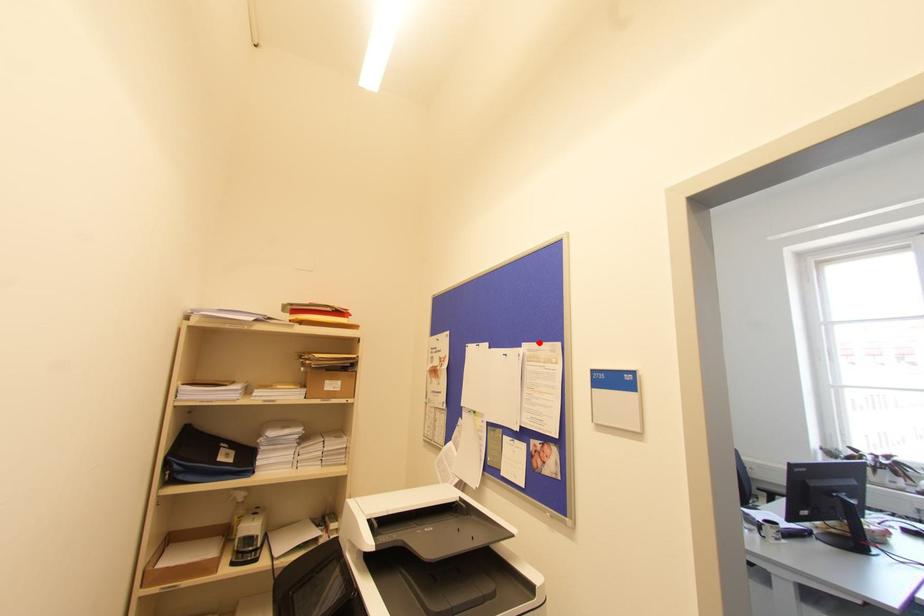
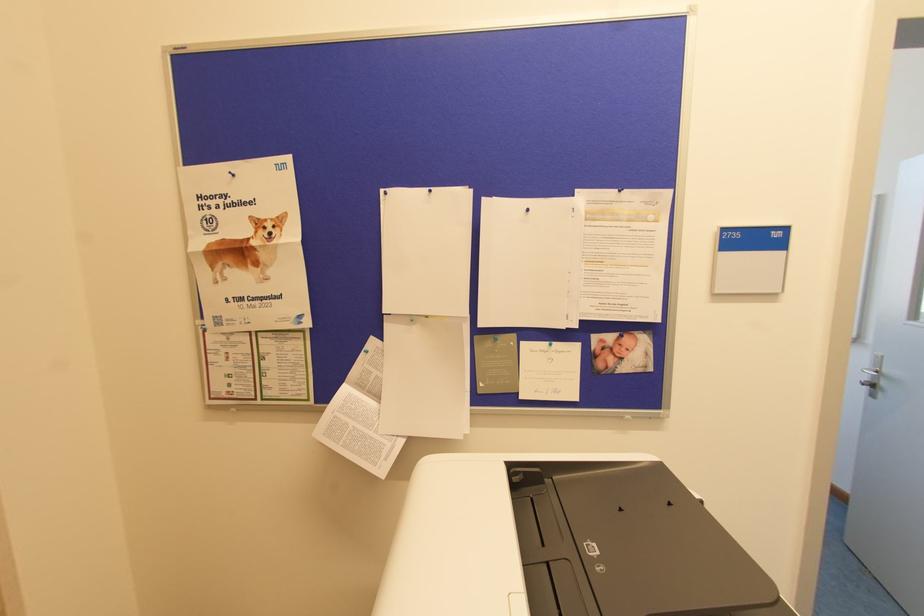
In the second image, find the point that corresponds to the highlighted location in the first image.

(619, 190)